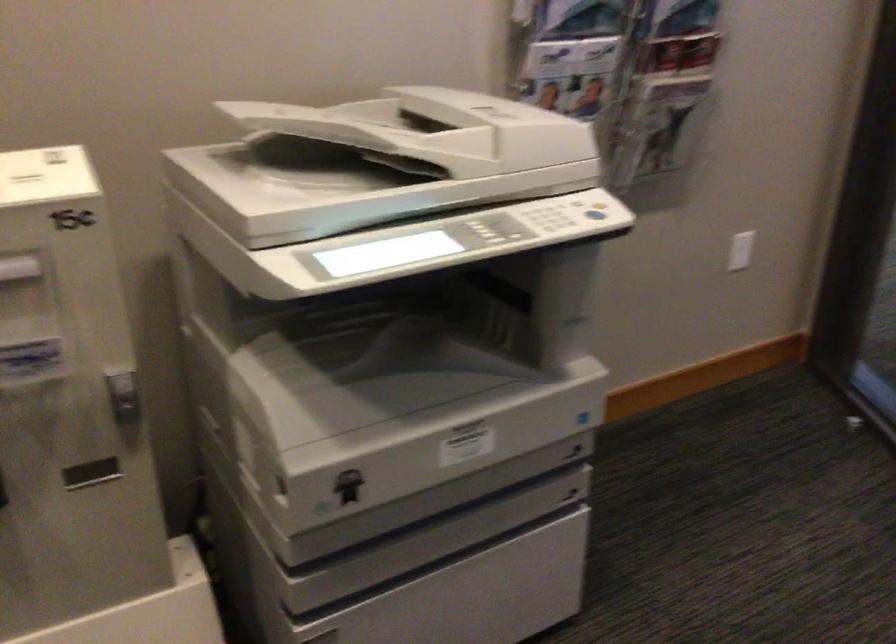
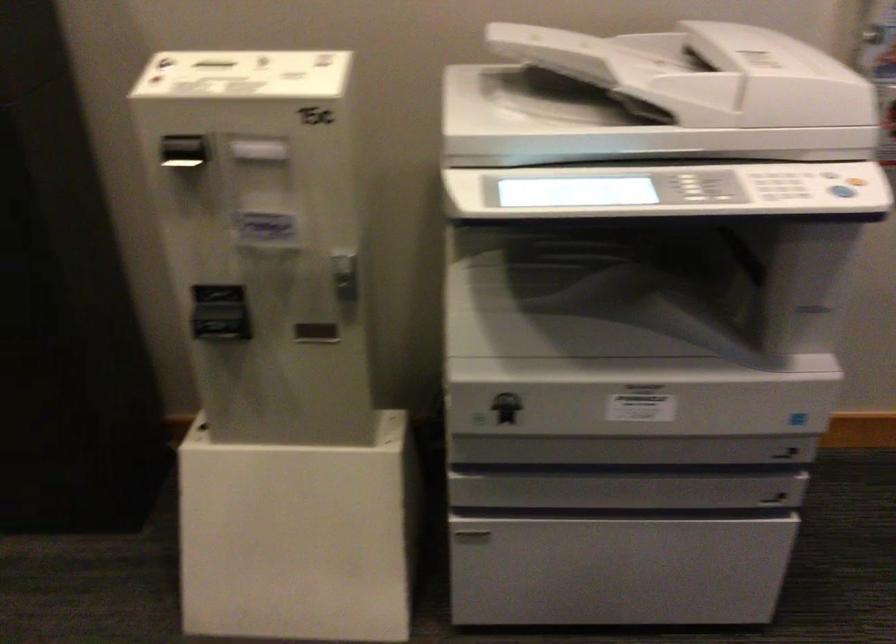
Locate, in the second image, the point that corresponds to pixel 97 469 in the first image.

(315, 333)